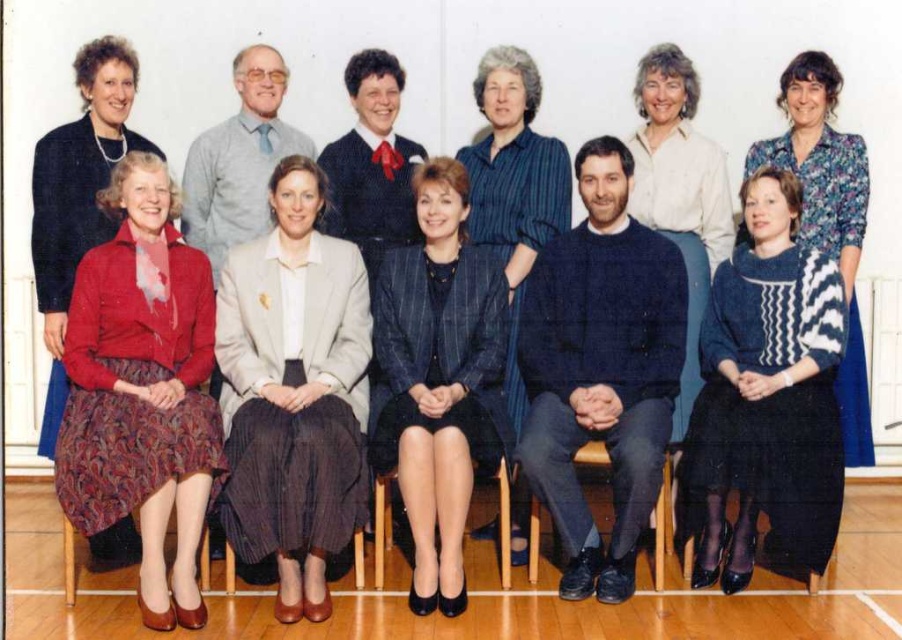
Can you confirm if matte red sweater at lower left is positioned below matte blue blouse at center?

Correct, matte red sweater at lower left is located below matte blue blouse at center.

Is matte red sweater at lower left bigger than matte blue blouse at center?

Yes.

Who is more distant from viewer, (134, 332) or (683, 104)?

The point (683, 104) is behind.

Where is `matte red sweater at lower left`? matte red sweater at lower left is located at coordinates (143, 388).

The height and width of the screenshot is (640, 902). What do you see at coordinates (438, 378) in the screenshot?
I see `dark blue pinstripe suit at center` at bounding box center [438, 378].

Does point (502, 376) come in front of point (514, 252)?

Yes, point (502, 376) is in front of point (514, 252).

Image resolution: width=902 pixels, height=640 pixels. What are the coordinates of `dark blue pinstripe suit at center` in the screenshot? It's located at (438, 378).

Which is above, dark blue pinstripe suit at center or wooden chair at center?

Positioned higher is dark blue pinstripe suit at center.

Looking at this image, is dark blue pinstripe suit at center wider than wooden chair at center?

Incorrect, dark blue pinstripe suit at center's width does not surpass wooden chair at center's.

This screenshot has height=640, width=902. Identify the location of dark blue pinstripe suit at center. (438, 378).

Image resolution: width=902 pixels, height=640 pixels. I want to click on dark blue pinstripe suit at center, so click(x=438, y=378).